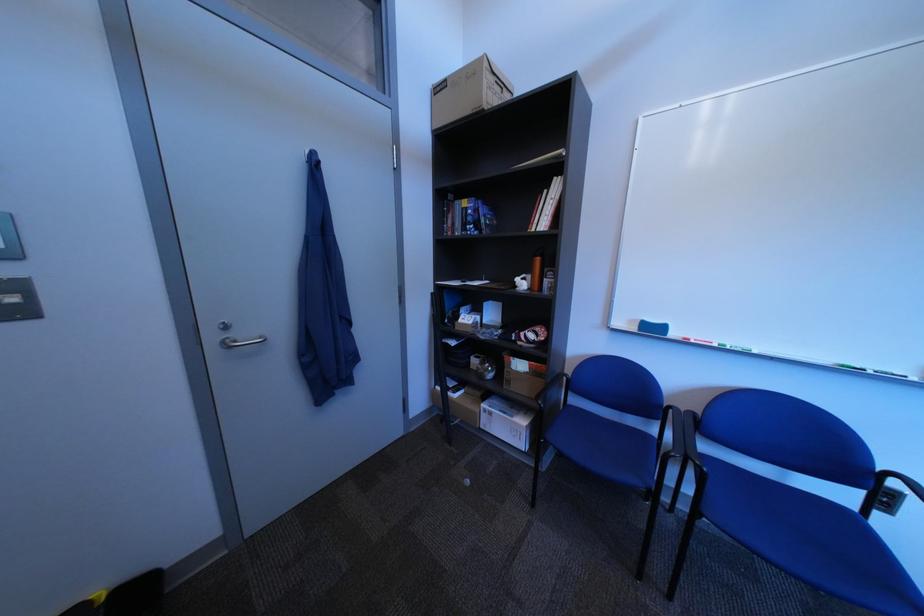
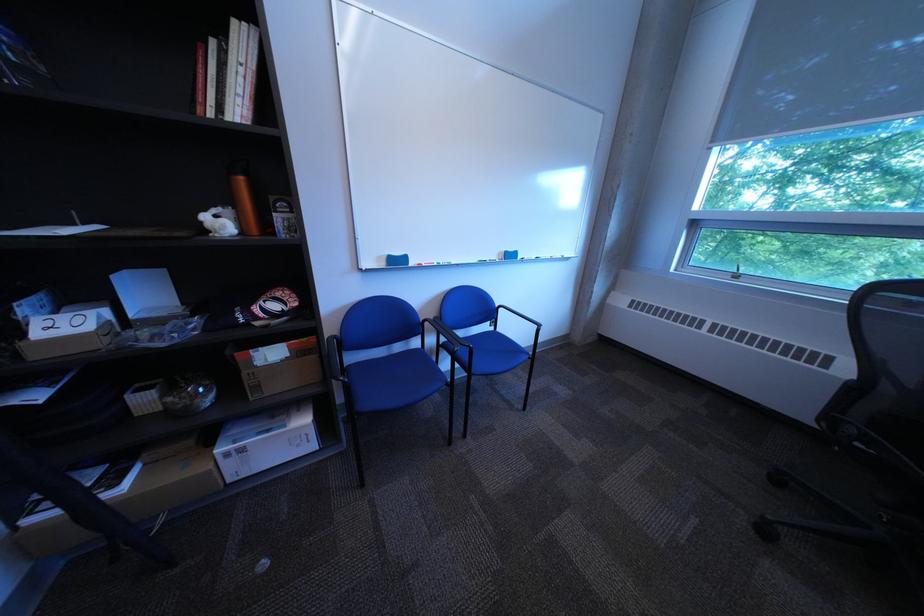
Based on the continuous images, in which direction is the camera rotating?

Result: The camera rotated toward right-down.